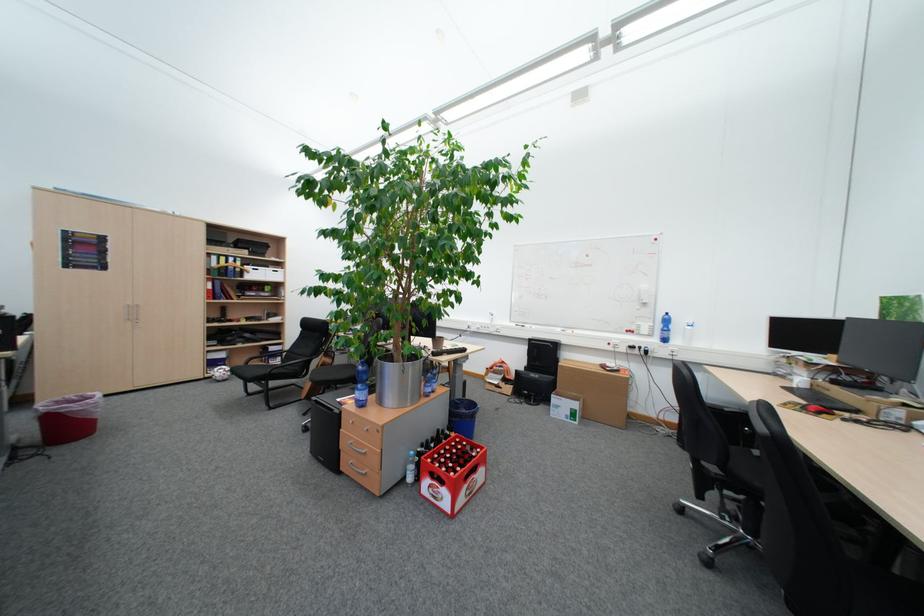
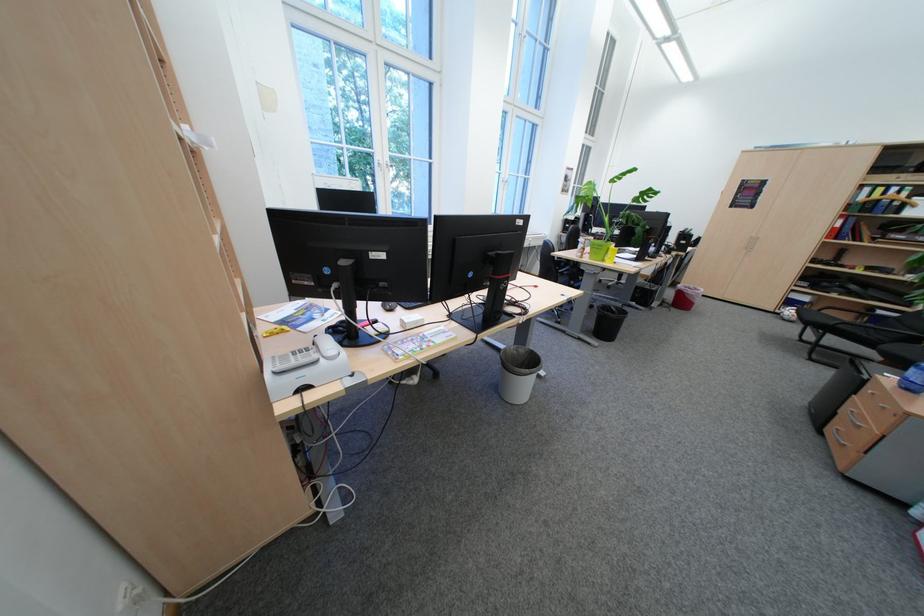
Question: I am providing you with two images of the same scene from different viewpoints. After the viewpoint changes to image2, which objects are now occluded?

Choices:
 (A) black trash can
 (B) blue binder
 (C) blue water bottle
 (D) none of these

Answer: (D)